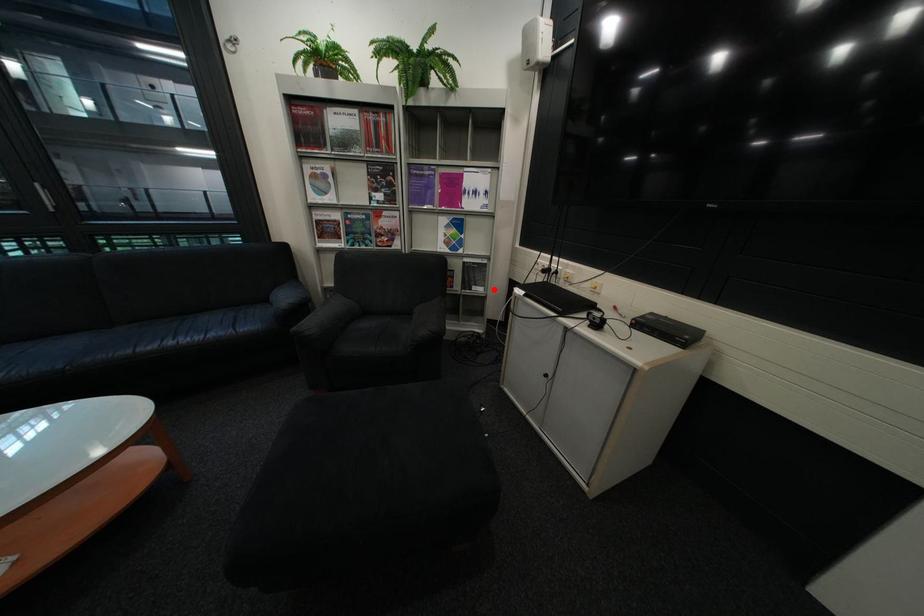
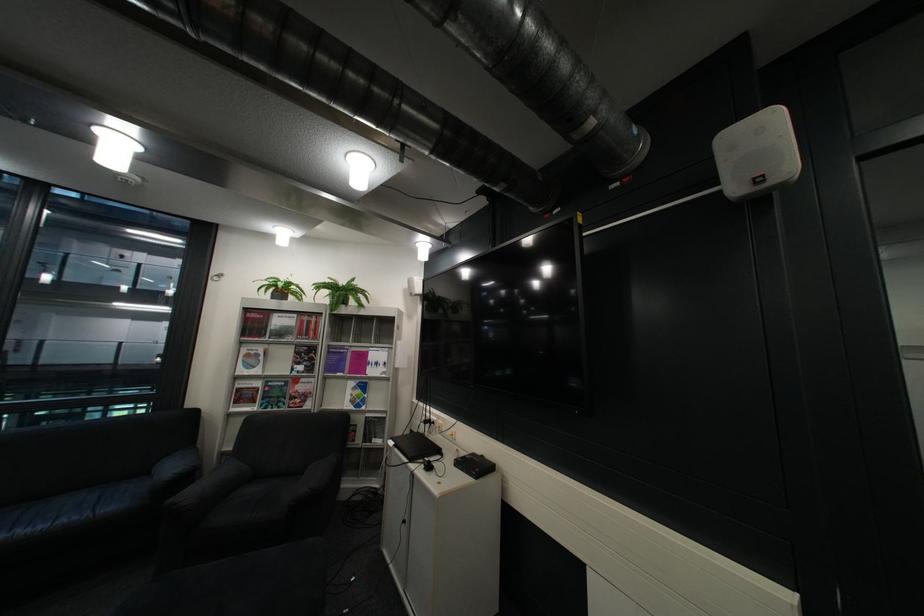
Question: I am providing you with two images of the same scene from different viewpoints. Image1 has a red point marked. In image2, the corresponding 3D location appears at what relative position? Reply with the corresponding letter.

Choices:
 (A) Closer
 (B) Farther

Answer: (B)